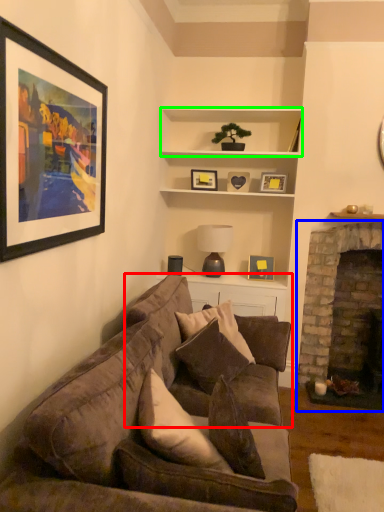
Question: Which object is the farthest from studio couch (highlighted by a red box)? Choose among these: fireplace (highlighted by a blue box) or cabinet (highlighted by a green box).

Choices:
 (A) fireplace
 (B) cabinet

Answer: (B)